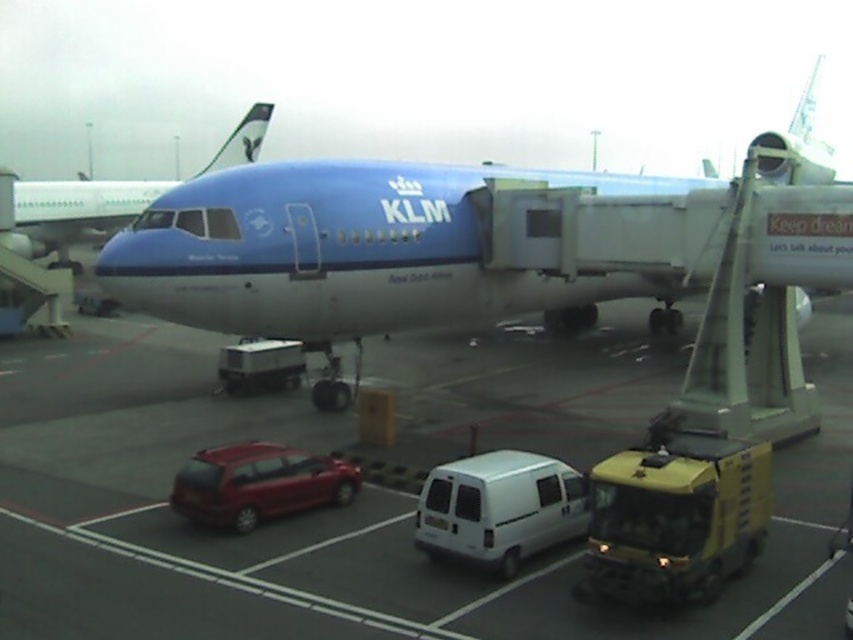
Question: Is yellow matte van at lower right positioned at the back of shiny red hatchback at lower left?

Choices:
 (A) yes
 (B) no

Answer: (B)

Question: Among these objects, which one is farthest from the camera?

Choices:
 (A) shiny red hatchback at lower left
 (B) yellow matte van at lower right
 (C) matte blue airplane at upper center
 (D) smooth asphalt tarmac at center

Answer: (C)

Question: Which object is positioned closest to the white matte van at center?

Choices:
 (A) blue polished airplane at center
 (B) shiny red hatchback at lower left
 (C) yellow matte van at lower right
 (D) matte blue airplane at upper center

Answer: (C)

Question: Does smooth asphalt tarmac at center appear on the right side of white matte van at center?

Choices:
 (A) yes
 (B) no

Answer: (B)

Question: Can you confirm if smooth asphalt tarmac at center is smaller than shiny red hatchback at lower left?

Choices:
 (A) no
 (B) yes

Answer: (A)

Question: Estimate the real-world distances between objects in this image. Which object is farther from the shiny red hatchback at lower left?

Choices:
 (A) white matte van at center
 (B) blue polished airplane at center
 (C) yellow matte van at lower right
 (D) smooth asphalt tarmac at center

Answer: (B)